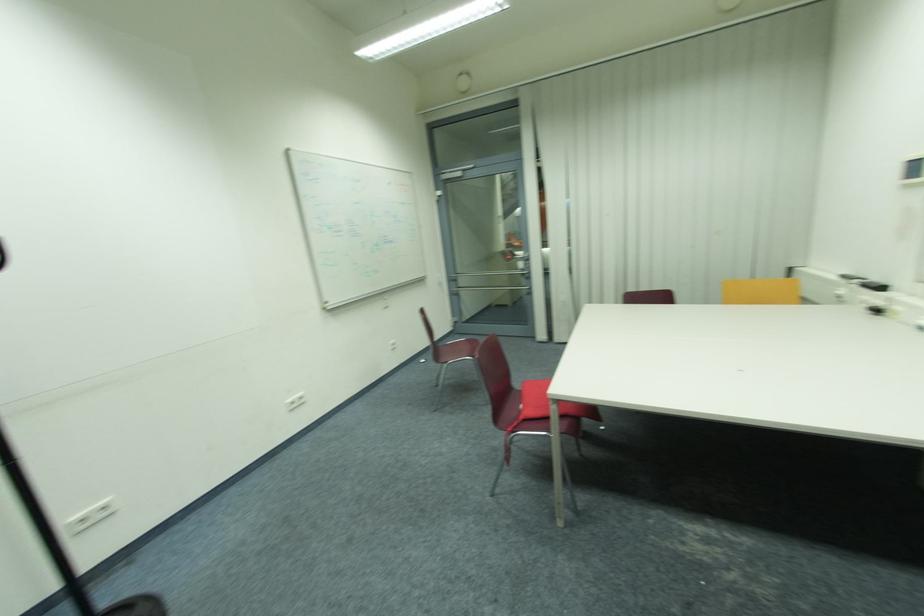
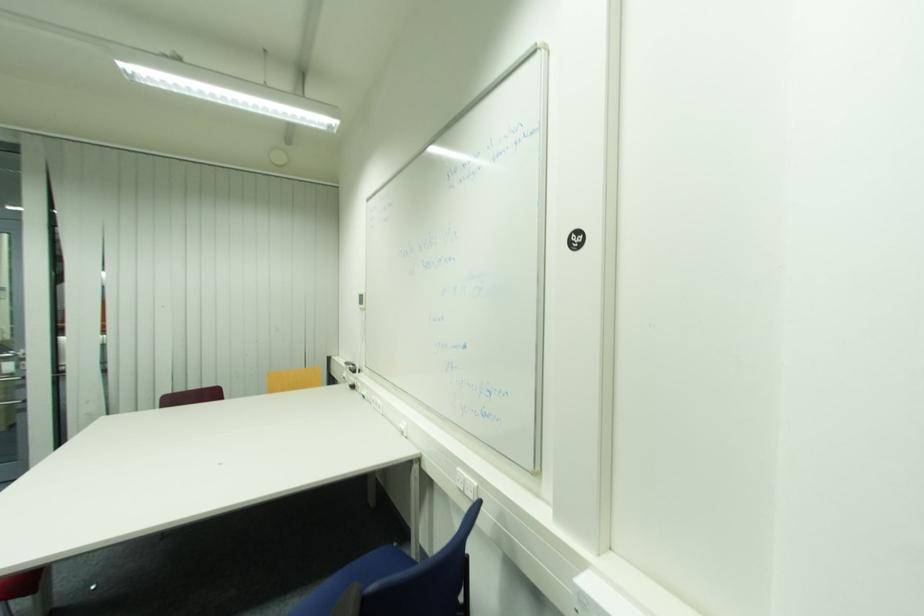
Question: The images are taken continuously from a first-person perspective. In which direction is your viewpoint rotating?

Choices:
 (A) Left
 (B) Right
 (C) Up
 (D) Down

Answer: (B)